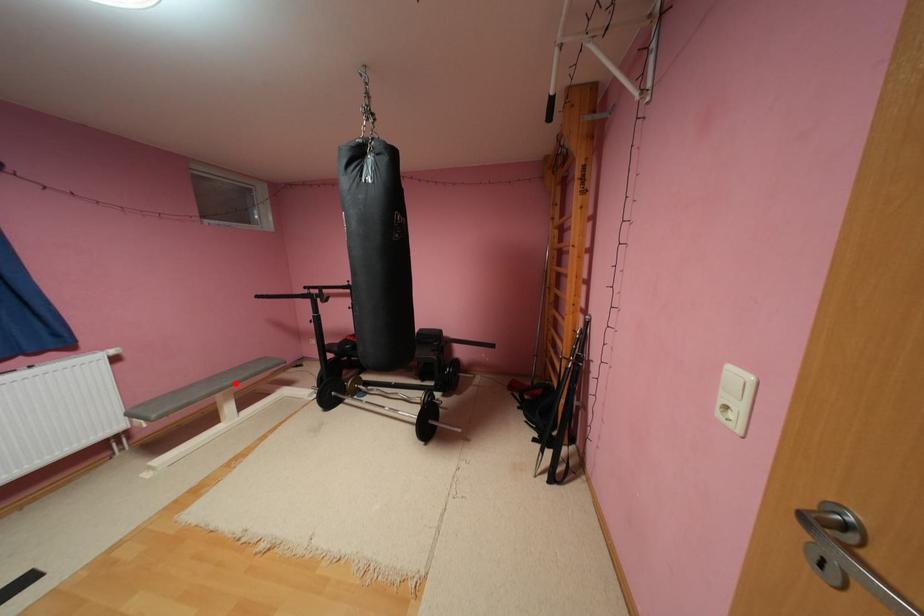
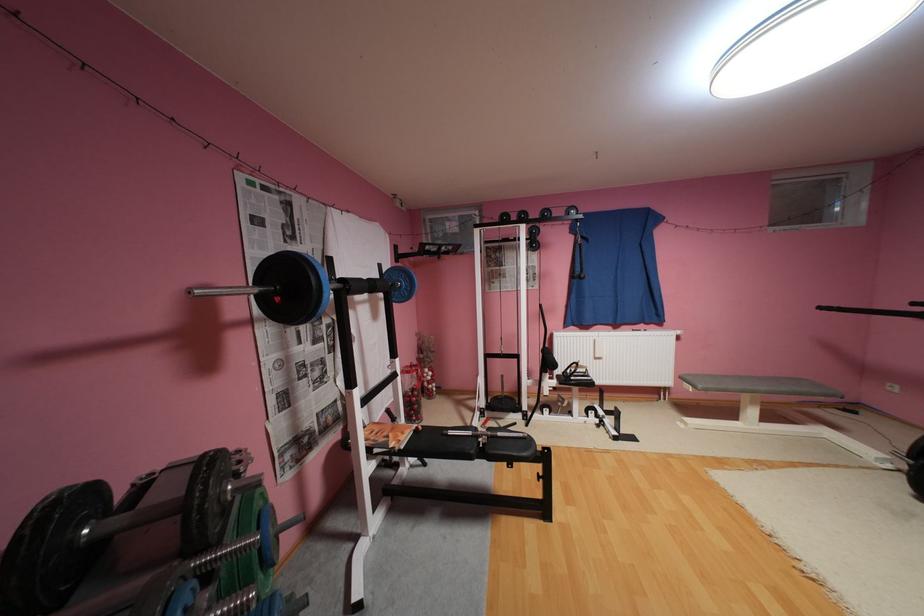
Question: I am providing you with two images of the same scene from different viewpoints. In image1, a red point is highlighted. Considering the same 3D point in image2, which of the following is correct?

Choices:
 (A) It is closer
 (B) It is farther

Answer: (B)